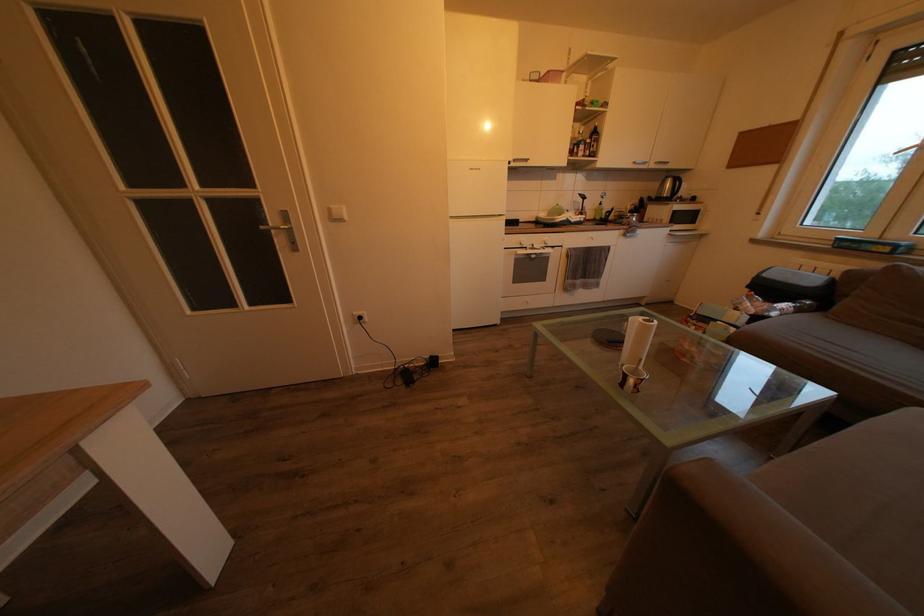
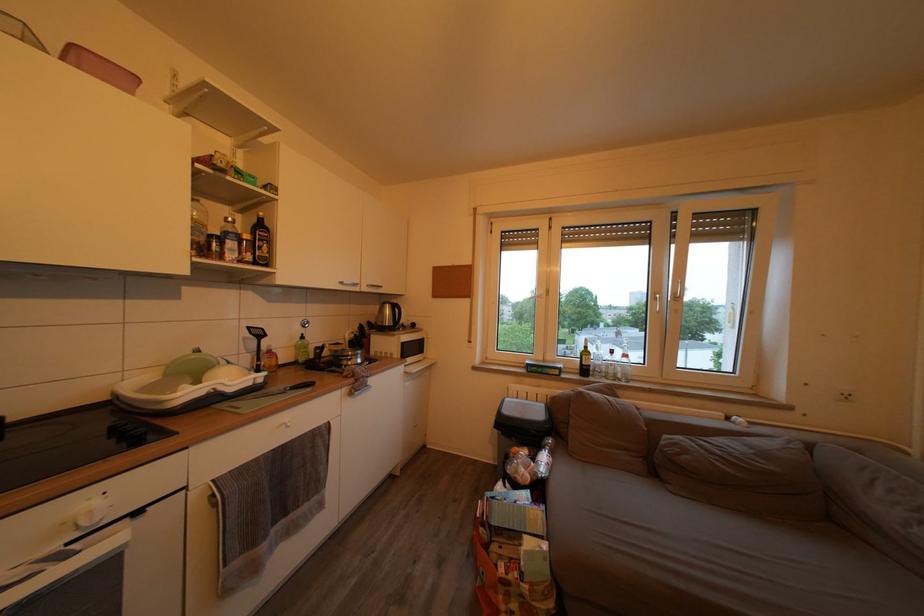
Locate, in the second image, the point that corresponds to (x=596, y=147) in the first image.

(253, 243)